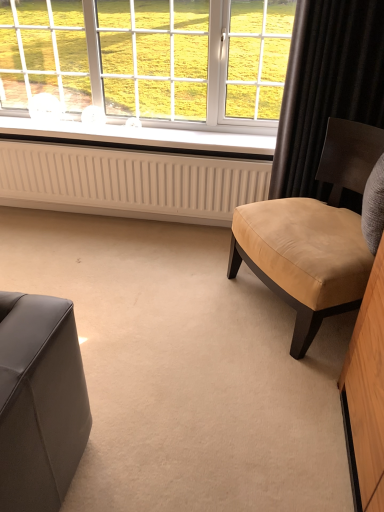
Question: Considering the positions of point [x=243, y=155] and point [x=226, y=223], is point [x=243, y=155] closer or farther from the camera than point [x=226, y=223]?

Choices:
 (A) farther
 (B) closer

Answer: (B)

Question: Considering the positions of white plastic window sill at center and white ribbed radiator at center in the image, is white plastic window sill at center wider or thinner than white ribbed radiator at center?

Choices:
 (A) thin
 (B) wide

Answer: (B)

Question: Which of these objects is positioned farthest from the tan leather chair at right?

Choices:
 (A) white plastic window sill at center
 (B) white ribbed radiator at center
 (C) black velvet curtain at upper right
 (D) white plastic window at upper center

Answer: (D)

Question: Estimate the real-world distances between objects in this image. Which object is closer to the white ribbed radiator at center?

Choices:
 (A) white plastic window sill at center
 (B) white plastic window at upper center
 (C) tan leather chair at right
 (D) black velvet curtain at upper right

Answer: (A)